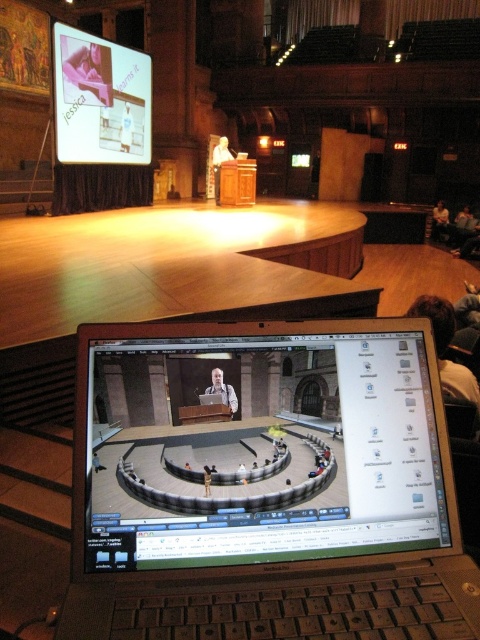
Question: Where is silver metallic laptop at center located in relation to dark brown leather jacket at upper right in the image?

Choices:
 (A) above
 (B) below

Answer: (B)

Question: Among these points, which one is nearest to the camera?

Choices:
 (A) (163, 404)
 (B) (206, 468)
 (C) (420, 300)

Answer: (B)

Question: Can you confirm if white shirt at center is smaller than smooth skin person at center?

Choices:
 (A) yes
 (B) no

Answer: (B)

Question: Which of these objects is positioned closest to the light brown wooden podium at center?

Choices:
 (A) smooth skin person at center
 (B) silver metallic laptop at center
 (C) white shirt at center

Answer: (B)

Question: Which point is farther from the camera taking this photo?

Choices:
 (A) (109, 428)
 (B) (216, 385)
 (C) (204, 468)

Answer: (B)

Question: In this image, where is dark brown leather jacket at upper right located relative to smooth skin person at center?

Choices:
 (A) left
 (B) right

Answer: (B)